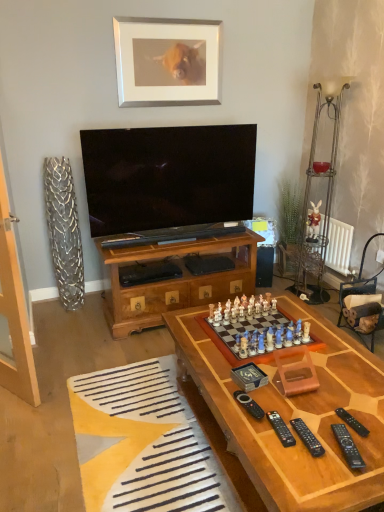
This screenshot has height=512, width=384. I want to click on vacant area that lies between black plastic remote at lower right, marked as the 2th remote in a right-to-left arrangement, and black plastic remote at lower right, which ranks as the 3th remote in right-to-left order, so click(319, 440).